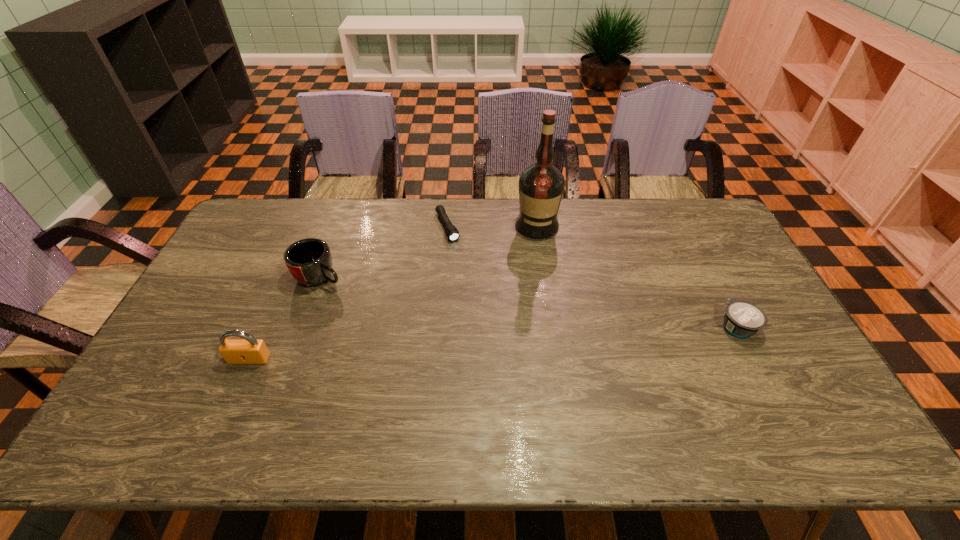
You are a GUI agent. You are given a task and a screenshot of the screen. Output one action in this format:
    pyautogui.click(x=<x>, y=<y>)
    Task: Click on the free spot on the desktop that is between the padlock and the fourth farthest object and is positioned on the surface of the second object from right to left
    This screenshot has height=540, width=960.
    Given the screenshot: What is the action you would take?
    [x=529, y=340]

Locate an element on the screen. The width and height of the screenshot is (960, 540). vacant space on the desktop that is between the nearest object and the second shortest object and is positioned at the lens end of the flashlight is located at coordinates (507, 342).

Find the location of a particular element. This screenshot has height=540, width=960. free space on the desktop that is between the nearest object and the yogurt and is positioned on the side of the third nearest object with the handle is located at coordinates (449, 346).